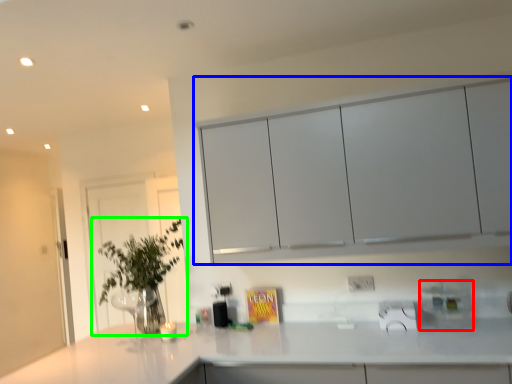
Question: Considering the real-world distances, which object is farthest from appliance (highlighted by a red box)? cabinetry (highlighted by a blue box) or houseplant (highlighted by a green box)?

Choices:
 (A) cabinetry
 (B) houseplant

Answer: (B)